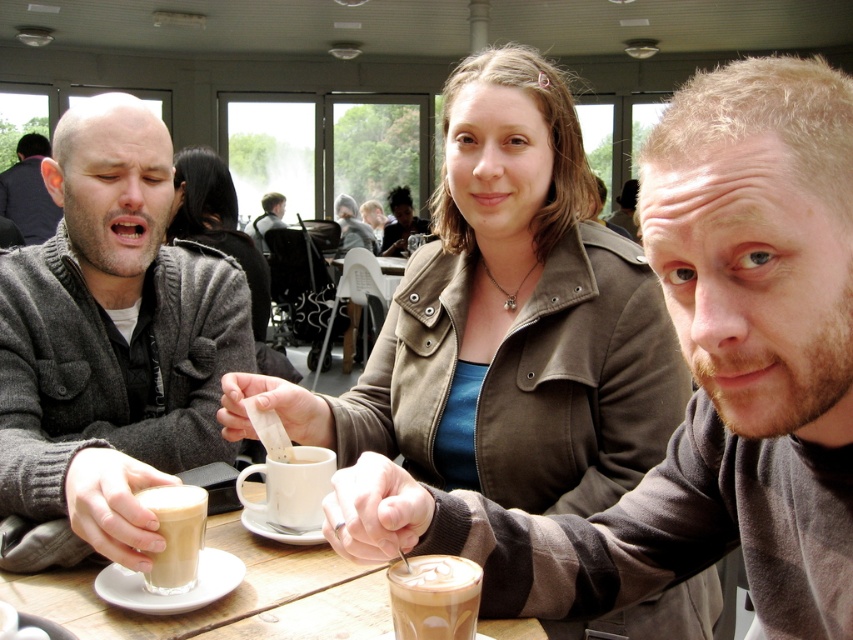
Which is more to the right, matte gray sweater at left or white frothy coffee at center?

white frothy coffee at center

The width and height of the screenshot is (853, 640). Find the location of `matte gray sweater at left`. matte gray sweater at left is located at coordinates (108, 332).

Between matte brown jacket at center and white frothy coffee at center, which one appears on the left side from the viewer's perspective?

Positioned to the left is matte brown jacket at center.

Is matte brown jacket at center positioned in front of white frothy coffee at center?

No, it is not.

Is point (183, 230) closer to viewer compared to point (279, 458)?

No, it is behind (279, 458).

At what (x,y) coordinates should I click in order to perform the action: click on matte brown jacket at center. Please return your answer as a coordinate pair (x, y). Looking at the image, I should click on (218, 224).

Does matte brown jacket at center have a smaller size compared to white ceramic mug at center?

Actually, matte brown jacket at center might be larger than white ceramic mug at center.

Is matte brown jacket at center thinner than white ceramic mug at center?

In fact, matte brown jacket at center might be wider than white ceramic mug at center.

Measure the distance between matte brown jacket at center and camera.

They are 2.69 meters apart.

Locate an element on the screen. Image resolution: width=853 pixels, height=640 pixels. matte brown jacket at center is located at coordinates (218, 224).